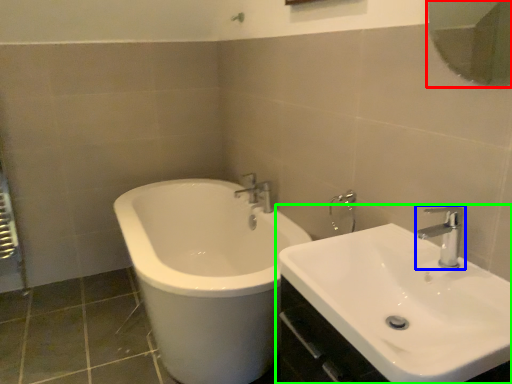
Question: Which object is the farthest from mirror (highlighted by a red box)? Choose among these: tap (highlighted by a blue box) or sink (highlighted by a green box).

Choices:
 (A) tap
 (B) sink

Answer: (B)